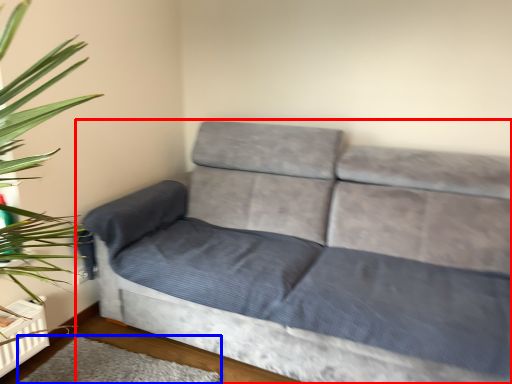
Question: Which of the following is the farthest to the observer, studio couch (highlighted by a red box) or mat (highlighted by a blue box)?

Choices:
 (A) studio couch
 (B) mat

Answer: (B)